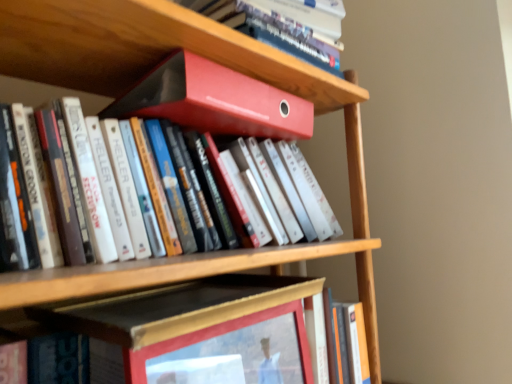
Question: Does orange matte book at lower right, which ranks as the first book in bottom-to-top order, come in front of wooden picture frame at center?

Choices:
 (A) yes
 (B) no

Answer: (B)

Question: From the image's perspective, is orange matte book at lower right, which appears as the fifth book when viewed from the top, located above wooden picture frame at center?

Choices:
 (A) no
 (B) yes

Answer: (A)

Question: Is orange matte book at lower right, which ranks as the first book in bottom-to-top order, not inside wooden picture frame at center?

Choices:
 (A) yes
 (B) no

Answer: (A)

Question: From a real-world perspective, is orange matte book at lower right, which ranks as the first book in bottom-to-top order, on top of wooden picture frame at center?

Choices:
 (A) yes
 (B) no

Answer: (B)

Question: Does orange matte book at lower right, which ranks as the first book in bottom-to-top order, have a smaller size compared to wooden picture frame at center?

Choices:
 (A) no
 (B) yes

Answer: (B)

Question: Looking at their shapes, would you say matte red folder at upper center, placed as the first book when sorted from top to bottom, is wider or thinner than orange matte book at lower right, which ranks as the first book in bottom-to-top order?

Choices:
 (A) thin
 (B) wide

Answer: (B)

Question: Visually, is matte red folder at upper center, placed as the first book when sorted from top to bottom, positioned to the left or to the right of orange matte book at lower right, which appears as the fifth book when viewed from the top?

Choices:
 (A) right
 (B) left

Answer: (B)

Question: Is matte red folder at upper center, which is the fifth book from bottom to top, taller or shorter than orange matte book at lower right, which appears as the fifth book when viewed from the top?

Choices:
 (A) short
 (B) tall

Answer: (A)

Question: In terms of size, does matte red folder at upper center, placed as the first book when sorted from top to bottom, appear bigger or smaller than orange matte book at lower right, which appears as the fifth book when viewed from the top?

Choices:
 (A) big
 (B) small

Answer: (A)

Question: From a real-world perspective, is matte red binder at upper center, the 4th book positioned from the bottom, positioned above or below matte red folder at upper center, which is the fifth book from bottom to top?

Choices:
 (A) above
 (B) below

Answer: (B)

Question: Considering the positions of matte red binder at upper center, the 4th book positioned from the bottom, and matte red folder at upper center, which is the fifth book from bottom to top, in the image, is matte red binder at upper center, the 4th book positioned from the bottom, wider or thinner than matte red folder at upper center, which is the fifth book from bottom to top,?

Choices:
 (A) wide
 (B) thin

Answer: (B)

Question: Is matte red binder at upper center, the 4th book positioned from the bottom, in front of or behind matte red folder at upper center, which is the fifth book from bottom to top, in the image?

Choices:
 (A) front
 (B) behind

Answer: (A)

Question: Is matte red binder at upper center, the 4th book positioned from the bottom, inside or outside of matte red folder at upper center, placed as the first book when sorted from top to bottom?

Choices:
 (A) outside
 (B) inside

Answer: (A)

Question: Which is correct: matte red binder at upper center, arranged as the second book when viewed from the top, is inside wooden picture frame at center, or outside of it?

Choices:
 (A) inside
 (B) outside

Answer: (B)

Question: From the image's perspective, is matte red binder at upper center, the 4th book positioned from the bottom, located above or below wooden picture frame at center?

Choices:
 (A) below
 (B) above

Answer: (B)